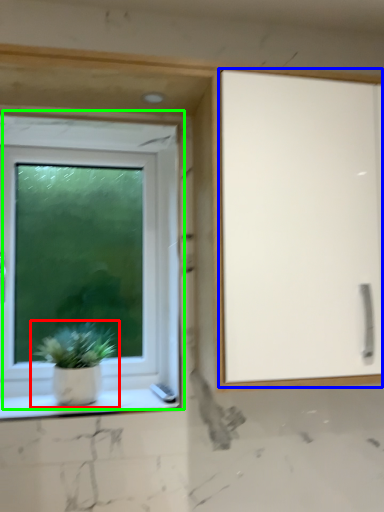
Question: Estimate the real-world distances between objects in this image. Which object is farther from houseplant (highlighted by a red box), screen door (highlighted by a blue box) or window (highlighted by a green box)?

Choices:
 (A) screen door
 (B) window

Answer: (A)